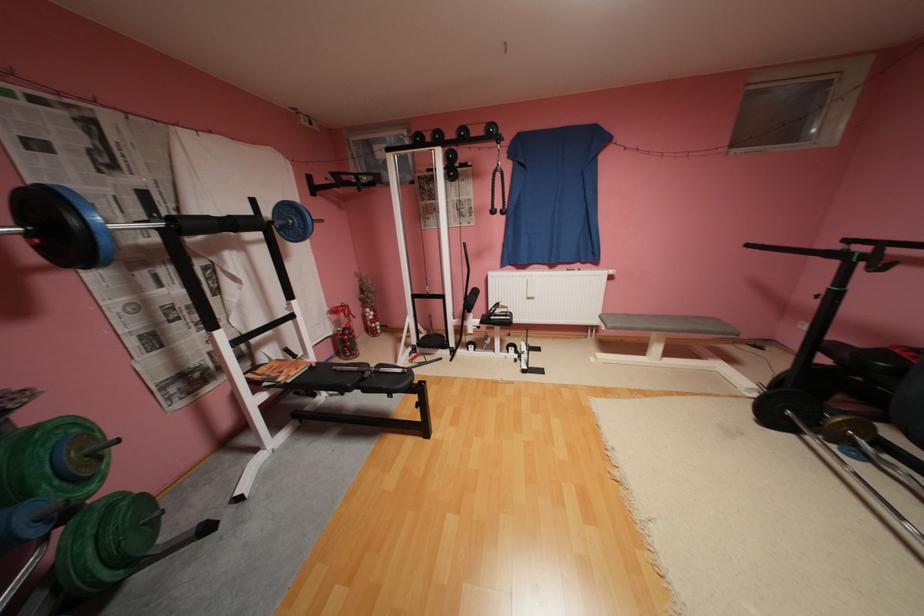
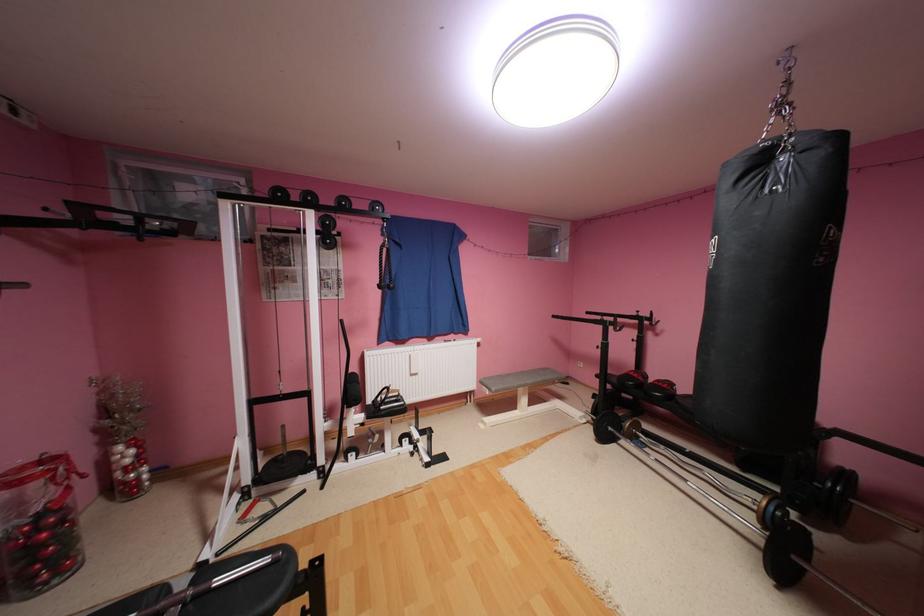
In the second image, find the point that corresponds to [342,180] in the first image.

(78, 216)